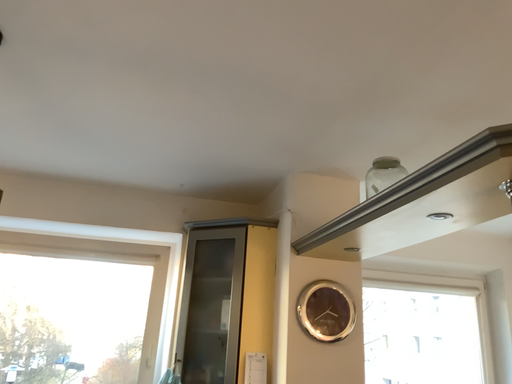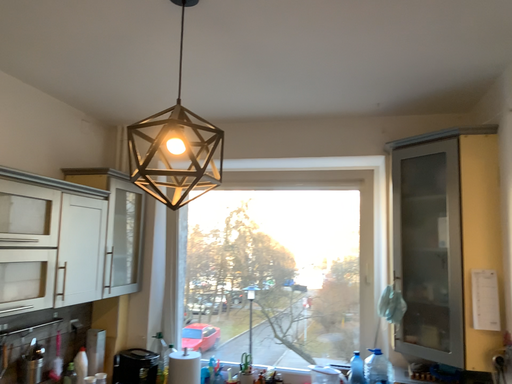
Question: Which way did the camera rotate in the video?

Choices:
 (A) rotated upward
 (B) rotated downward

Answer: (B)